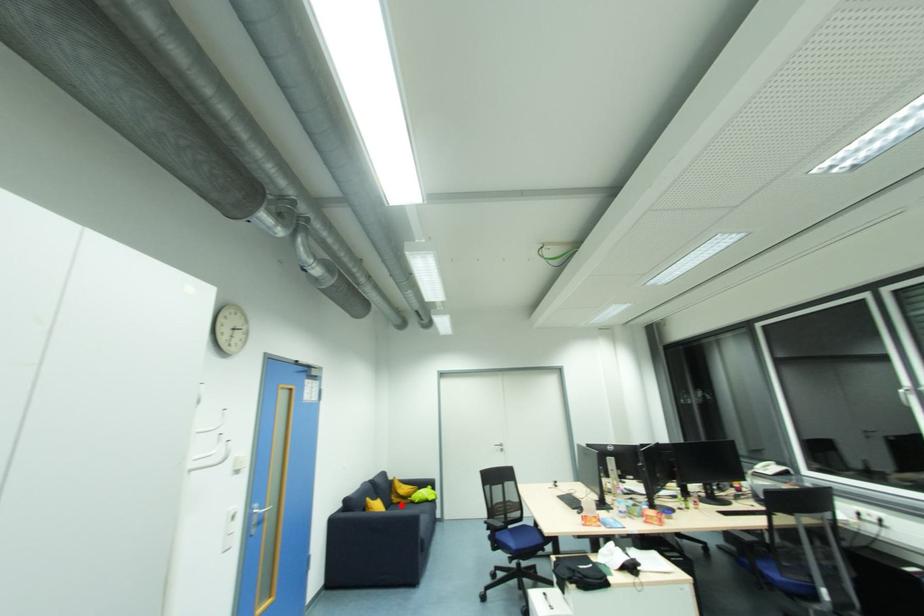
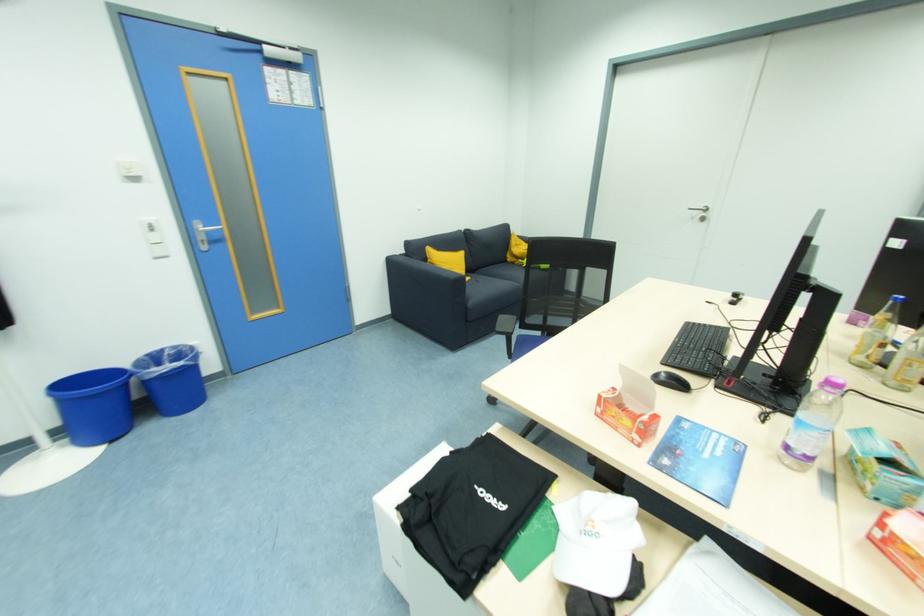
Question: I am providing you with two images of the same scene from different viewpoints. In image1, a red point is highlighted. Considering the same 3D point in image2, which of the following is correct?

Choices:
 (A) It is closer
 (B) It is farther

Answer: (A)